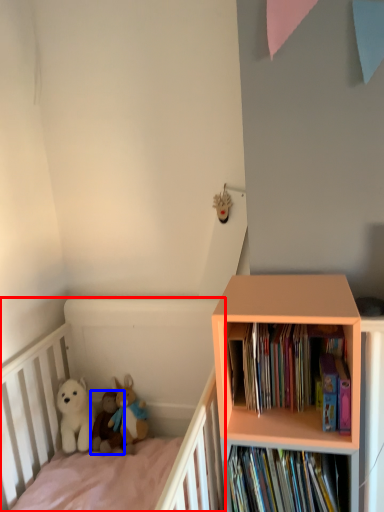
Question: Which of the following is the farthest to the observer, infant bed (highlighted by a red box) or toy (highlighted by a blue box)?

Choices:
 (A) infant bed
 (B) toy

Answer: (B)